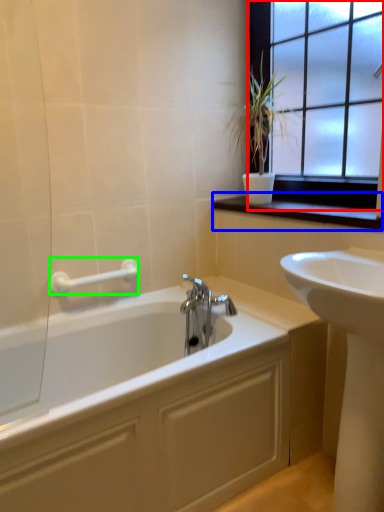
Question: Which object is the farthest from window (highlighted by a red box)? Choose among these: window sill (highlighted by a blue box) or towel bar (highlighted by a green box).

Choices:
 (A) window sill
 (B) towel bar

Answer: (B)